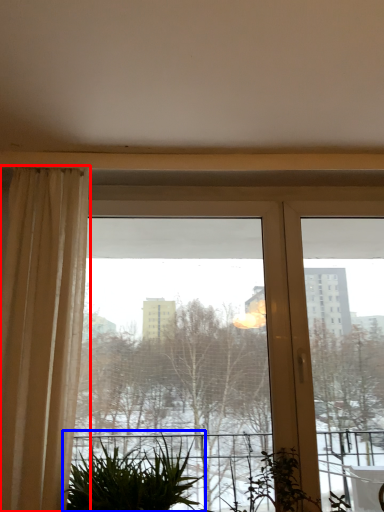
Question: Which object appears farthest to the camera in this image, curtain (highlighted by a red box) or houseplant (highlighted by a blue box)?

Choices:
 (A) curtain
 (B) houseplant

Answer: (B)